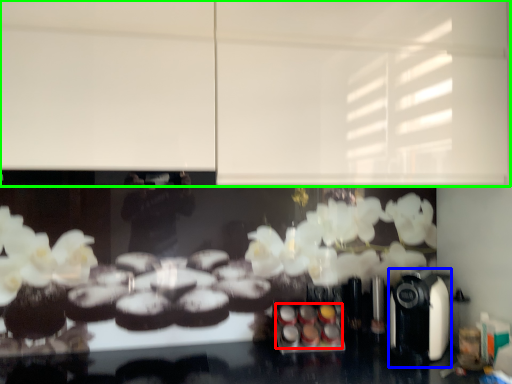
Question: Estimate the real-world distances between objects in this image. Which object is farther from food (highlighted by a red box), coffee machine (highlighted by a blue box) or backdrop (highlighted by a green box)?

Choices:
 (A) coffee machine
 (B) backdrop

Answer: (B)